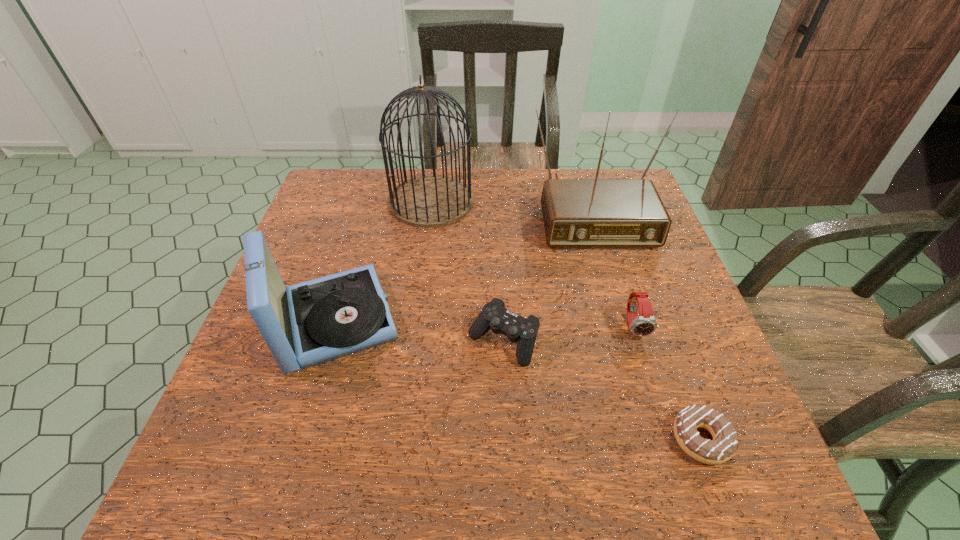
This screenshot has width=960, height=540. I want to click on vacant space that's between the fifth shortest object and the fifth tallest object, so click(546, 275).

Identify the location of free spot between the shortest object and the control. (602, 390).

Where is `free space between the second shortest object and the third shortest object`? The width and height of the screenshot is (960, 540). free space between the second shortest object and the third shortest object is located at coordinates (569, 334).

At what (x,y) coordinates should I click in order to perform the action: click on free point between the nearest object and the fourth tallest object. Please return your answer as a coordinate pair (x, y). Looking at the image, I should click on (668, 383).

Where is `vacant space that is in between the nearest object and the birdcage`? This screenshot has width=960, height=540. vacant space that is in between the nearest object and the birdcage is located at coordinates (566, 320).

At what (x,y) coordinates should I click in order to perform the action: click on vacant space that's between the third shortest object and the birdcage. Please return your answer as a coordinate pair (x, y). This screenshot has height=540, width=960. Looking at the image, I should click on (533, 264).

The image size is (960, 540). Find the location of `the fourth closest object to the third shortest object`. the fourth closest object to the third shortest object is located at coordinates (429, 201).

Select which object appears as the closest to the birdcage. Please provide its 2D coordinates. Your answer should be formatted as a tuple, i.e. [(x, y)], where the tuple contains the x and y coordinates of a point satisfying the conditions above.

[(577, 213)]

At what (x,y) coordinates should I click in order to perform the action: click on blank area in the image that satisfies the following two spatial constraints: 1. on the front side of the phonograph record; 2. on the right side of the shortest object. Please return your answer as a coordinate pair (x, y). Looking at the image, I should click on (298, 439).

Where is `vacant point that satisfies the following two spatial constraints: 1. on the face of the doughnut; 2. on the right side of the watch`? vacant point that satisfies the following two spatial constraints: 1. on the face of the doughnut; 2. on the right side of the watch is located at coordinates (670, 439).